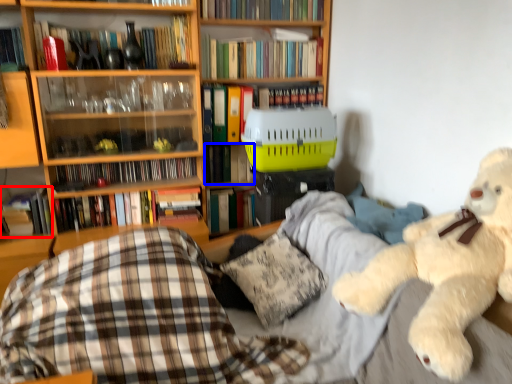
Question: Which of the following is the farthest to the observer, book (highlighted by a red box) or book (highlighted by a blue box)?

Choices:
 (A) book
 (B) book

Answer: (B)